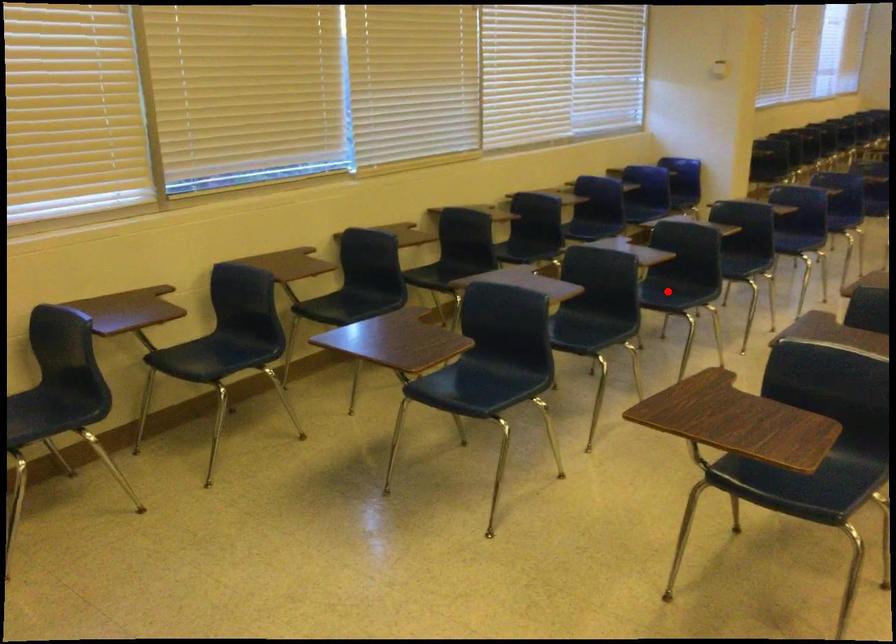
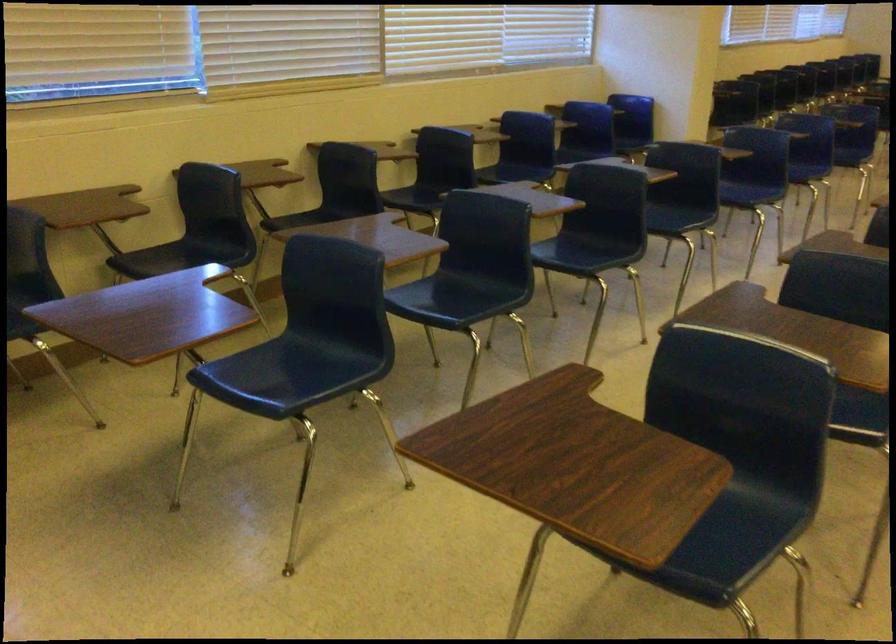
Question: I am providing you with two images of the same scene from different viewpoints. A red point is marked on the first image. At the location where the point appears in image 1, is it still visible in image 2?

Choices:
 (A) Yes
 (B) No

Answer: (A)